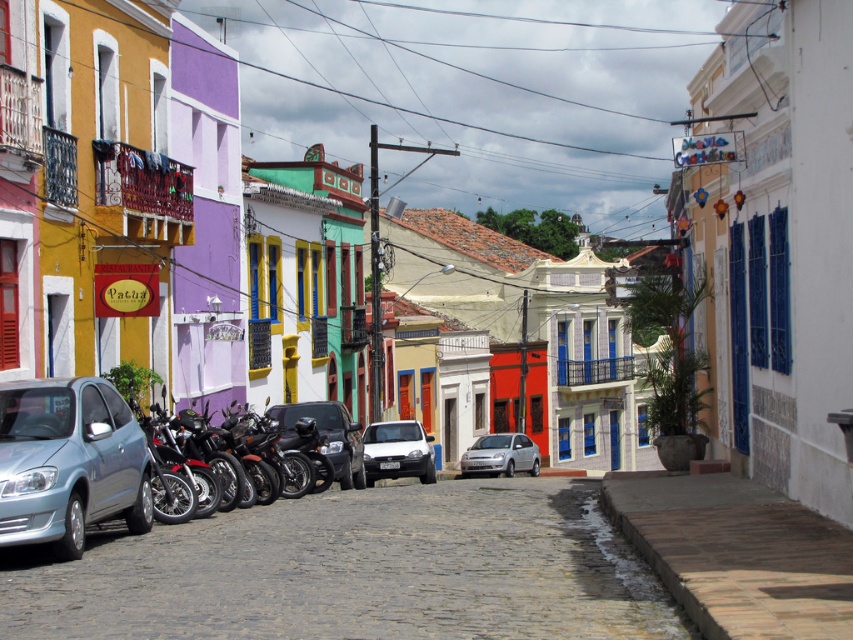
Question: Can you confirm if gray cobblestone alley at center is positioned above shiny black car at center?

Choices:
 (A) yes
 (B) no

Answer: (B)

Question: Among these objects, which one is nearest to the camera?

Choices:
 (A) silver metallic car at center
 (B) shiny black car at center
 (C) gray cobblestone alley at center

Answer: (C)

Question: Is gray cobblestone alley at center above silver metallic car at center?

Choices:
 (A) no
 (B) yes

Answer: (B)

Question: Among these objects, which one is farthest from the camera?

Choices:
 (A) gray cobblestone alley at center
 (B) shiny black car at center
 (C) silver metallic car at center
 (D) white matte car at center

Answer: (C)

Question: Is white matte car at center above silver metallic car at center?

Choices:
 (A) no
 (B) yes

Answer: (B)

Question: Which point is farther to the camera?

Choices:
 (A) gray cobblestone alley at center
 (B) white matte car at center
 (C) light blue metallic car at lower left
 (D) silver metallic car at center

Answer: (D)